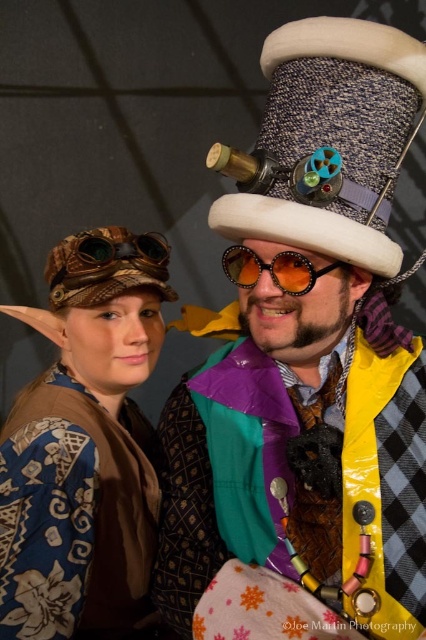
Is steampunk hat at center in front of shiny orange sunglasses at center?

Yes, steampunk hat at center is closer to the viewer.

Who is taller, steampunk hat at center or shiny orange sunglasses at center?

steampunk hat at center is taller.

The image size is (426, 640). In order to click on steampunk hat at center in this screenshot , I will do click(x=311, y=352).

Who is more distant from viewer, (376, 397) or (287, 234)?

The point (376, 397) is more distant.

Which is below, steampunk hat at center or speckled fabric dress hat at upper center?

steampunk hat at center is below.

You are a GUI agent. You are given a task and a screenshot of the screen. Output one action in this format:
    pyautogui.click(x=<x>, y=<y>)
    Task: Click on the steampunk hat at center
    This screenshot has width=426, height=640.
    Given the screenshot: What is the action you would take?
    pyautogui.click(x=311, y=352)

Locate an element on the screen. steampunk hat at center is located at coordinates (311, 352).

Does steampunk hat at center appear over blue fabric hat at upper left?

Yes, steampunk hat at center is above blue fabric hat at upper left.

Does steampunk hat at center appear on the left side of blue fabric hat at upper left?

Incorrect, steampunk hat at center is not on the left side of blue fabric hat at upper left.

Who is more forward, (270, 330) or (115, 400)?

Positioned in front is point (270, 330).

At what (x,y) coordinates should I click in order to perform the action: click on steampunk hat at center. Please return your answer as a coordinate pair (x, y). This screenshot has width=426, height=640. Looking at the image, I should click on click(x=311, y=352).